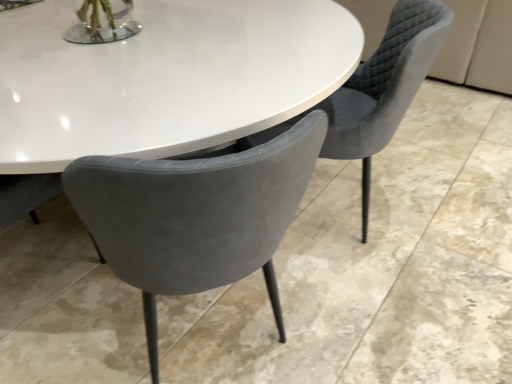
What is the approximate height of velvet grey chair at center, arranged as the 2th chair when viewed from the left?

The height of velvet grey chair at center, arranged as the 2th chair when viewed from the left, is 33.45 inches.

The width and height of the screenshot is (512, 384). Find the location of `velvet grey chair at center, arranged as the 2th chair when viewed from the left`. velvet grey chair at center, arranged as the 2th chair when viewed from the left is located at coordinates pos(377,90).

Measure the distance between velvet grey chair at center, arranged as the 2th chair when viewed from the left, and camera.

A distance of 3.80 feet exists between velvet grey chair at center, arranged as the 2th chair when viewed from the left, and camera.

This screenshot has width=512, height=384. What do you see at coordinates (377, 90) in the screenshot?
I see `velvet grey chair at center, arranged as the 2th chair when viewed from the left` at bounding box center [377, 90].

What is the approximate height of matte gray chair at center, the 1th chair from the left?

matte gray chair at center, the 1th chair from the left, is 32.70 inches tall.

What are the coordinates of `matte gray chair at center, the 1th chair from the left` in the screenshot? It's located at (195, 216).

What do you see at coordinates (195, 216) in the screenshot?
I see `matte gray chair at center, the 1th chair from the left` at bounding box center [195, 216].

This screenshot has width=512, height=384. What are the coordinates of `velvet grey chair at center, which ranks as the first chair in right-to-left order` in the screenshot? It's located at (377, 90).

Considering the relative positions of velvet grey chair at center, arranged as the 2th chair when viewed from the left, and matte gray chair at center, the 1th chair from the left, in the image provided, is velvet grey chair at center, arranged as the 2th chair when viewed from the left, to the left or to the right of matte gray chair at center, the 1th chair from the left,?

Based on their positions, velvet grey chair at center, arranged as the 2th chair when viewed from the left, is located to the right of matte gray chair at center, the 1th chair from the left.

Is velvet grey chair at center, which ranks as the first chair in right-to-left order, in front of matte gray chair at center, the 1th chair from the left?

No, velvet grey chair at center, which ranks as the first chair in right-to-left order, is further to the viewer.

Looking at this image, which point is more distant from viewer, (284,122) or (194,176)?

The point (284,122) is behind.

From the image's perspective, does velvet grey chair at center, arranged as the 2th chair when viewed from the left, appear higher than matte gray chair at center, which is the second chair from right to left?

Yes.

From a real-world perspective, is velvet grey chair at center, which ranks as the first chair in right-to-left order, physically below matte gray chair at center, which is the second chair from right to left?

Correct, in the physical world, velvet grey chair at center, which ranks as the first chair in right-to-left order, is lower than matte gray chair at center, which is the second chair from right to left.

Considering the sizes of objects velvet grey chair at center, arranged as the 2th chair when viewed from the left, and matte gray chair at center, the 1th chair from the left, in the image provided, who is thinner, velvet grey chair at center, arranged as the 2th chair when viewed from the left, or matte gray chair at center, the 1th chair from the left,?

Thinner between the two is matte gray chair at center, the 1th chair from the left.

Can you confirm if velvet grey chair at center, which ranks as the first chair in right-to-left order, is shorter than matte gray chair at center, the 1th chair from the left?

No.

Does velvet grey chair at center, which ranks as the first chair in right-to-left order, have a smaller size compared to matte gray chair at center, the 1th chair from the left?

No.

Is velvet grey chair at center, which ranks as the first chair in right-to-left order, inside the boundaries of matte gray chair at center, which is the second chair from right to left, or outside?

velvet grey chair at center, which ranks as the first chair in right-to-left order, exists outside the volume of matte gray chair at center, which is the second chair from right to left.

Is velvet grey chair at center, arranged as the 2th chair when viewed from the left, next to matte gray chair at center, which is the second chair from right to left?

There is a gap between velvet grey chair at center, arranged as the 2th chair when viewed from the left, and matte gray chair at center, which is the second chair from right to left.

Based on the photo, is velvet grey chair at center, which ranks as the first chair in right-to-left order, aimed at matte gray chair at center, the 1th chair from the left?

No, velvet grey chair at center, which ranks as the first chair in right-to-left order, is not facing towards matte gray chair at center, the 1th chair from the left.

How different are the orientations of velvet grey chair at center, arranged as the 2th chair when viewed from the left, and matte gray chair at center, which is the second chair from right to left, in degrees?

velvet grey chair at center, arranged as the 2th chair when viewed from the left, and matte gray chair at center, which is the second chair from right to left, are facing 50.8 degrees away from each other.

Locate an element on the screen. The image size is (512, 384). chair that is on the right side of matte gray chair at center, the 1th chair from the left is located at coordinates (377, 90).

Does matte gray chair at center, the 1th chair from the left, appear on the right side of velvet grey chair at center, which ranks as the first chair in right-to-left order?

No, matte gray chair at center, the 1th chair from the left, is not to the right of velvet grey chair at center, which ranks as the first chair in right-to-left order.

Which object is closer to the camera, matte gray chair at center, the 1th chair from the left, or velvet grey chair at center, which ranks as the first chair in right-to-left order?

matte gray chair at center, the 1th chair from the left.

Is point (270, 142) positioned before point (390, 103)?

Yes, point (270, 142) is in front of point (390, 103).

From the image's perspective, which object appears higher, matte gray chair at center, which is the second chair from right to left, or velvet grey chair at center, arranged as the 2th chair when viewed from the left?

velvet grey chair at center, arranged as the 2th chair when viewed from the left, from the image's perspective.

From a real-world perspective, which is physically above, matte gray chair at center, the 1th chair from the left, or velvet grey chair at center, arranged as the 2th chair when viewed from the left?

matte gray chair at center, the 1th chair from the left, is physically above.

Is matte gray chair at center, the 1th chair from the left, wider or thinner than velvet grey chair at center, which ranks as the first chair in right-to-left order?

matte gray chair at center, the 1th chair from the left, is thinner than velvet grey chair at center, which ranks as the first chair in right-to-left order.

Between matte gray chair at center, the 1th chair from the left, and velvet grey chair at center, which ranks as the first chair in right-to-left order, which one has less height?

Standing shorter between the two is matte gray chair at center, the 1th chair from the left.

Between matte gray chair at center, the 1th chair from the left, and velvet grey chair at center, arranged as the 2th chair when viewed from the left, which one has smaller size?

Smaller between the two is matte gray chair at center, the 1th chair from the left.

Is matte gray chair at center, which is the second chair from right to left, not inside velvet grey chair at center, which ranks as the first chair in right-to-left order?

That's correct, matte gray chair at center, which is the second chair from right to left, is outside of velvet grey chair at center, which ranks as the first chair in right-to-left order.

Are matte gray chair at center, which is the second chair from right to left, and velvet grey chair at center, arranged as the 2th chair when viewed from the left, beside each other?

No, matte gray chair at center, which is the second chair from right to left, is not with velvet grey chair at center, arranged as the 2th chair when viewed from the left.

Is matte gray chair at center, the 1th chair from the left, oriented towards velvet grey chair at center, arranged as the 2th chair when viewed from the left?

No, matte gray chair at center, the 1th chair from the left, is not oriented towards velvet grey chair at center, arranged as the 2th chair when viewed from the left.

What's the angular difference between matte gray chair at center, which is the second chair from right to left, and velvet grey chair at center, arranged as the 2th chair when viewed from the left,'s facing directions?

They differ by 50.8 degrees in their facing directions.

Find the location of a particular element. This screenshot has height=384, width=512. chair behind the matte gray chair at center, which is the second chair from right to left is located at coordinates (377, 90).

This screenshot has width=512, height=384. Find the location of `chair above the velvet grey chair at center, which ranks as the first chair in right-to-left order (from a real-world perspective)`. chair above the velvet grey chair at center, which ranks as the first chair in right-to-left order (from a real-world perspective) is located at coordinates (195, 216).

I want to click on chair in front of the velvet grey chair at center, arranged as the 2th chair when viewed from the left, so click(x=195, y=216).